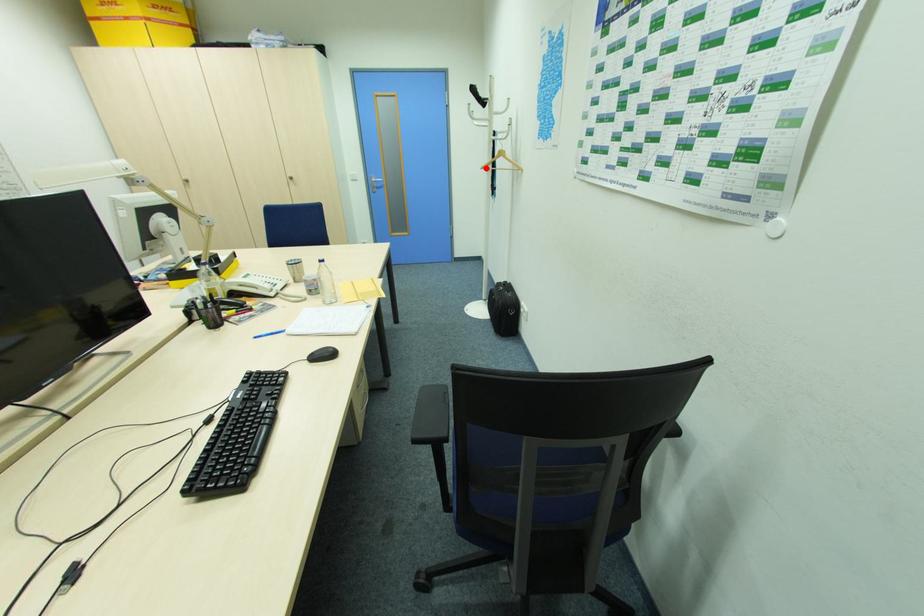
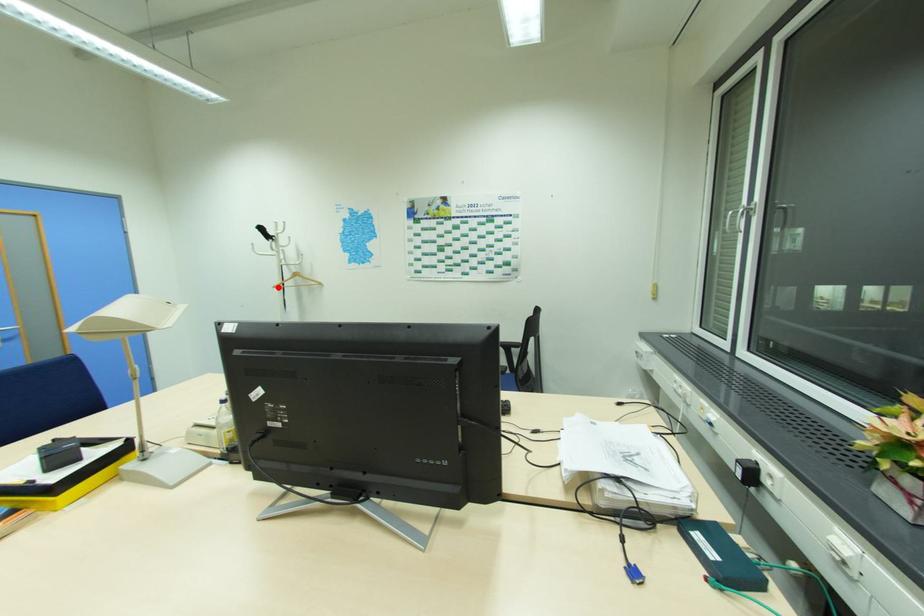
I am providing you with two images of the same scene from different viewpoints. A red point is marked on the first image and another point is marked on the second image. Do the highlighted points in image1 and image2 indicate the same real-world spot?

Yes